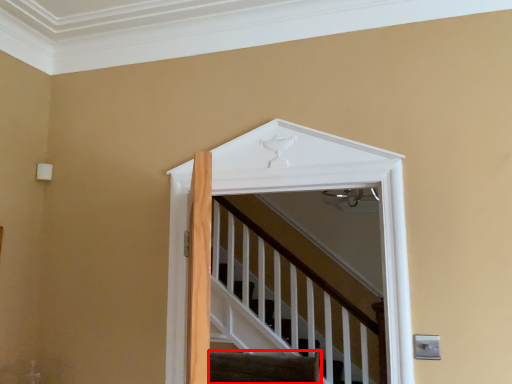
Question: In this image, where is stairs (annotated by the red box) located relative to elevator?

Choices:
 (A) right
 (B) left

Answer: (B)